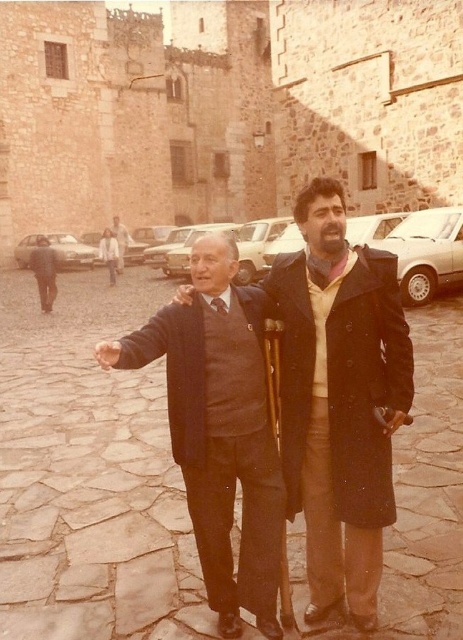
Question: Is dark blue wool coat at center to the left of matte silver sedan at left from the viewer's perspective?

Choices:
 (A) no
 (B) yes

Answer: (A)

Question: Which object is farther from the camera taking this photo?

Choices:
 (A) dark brown leather coat at center
 (B) white glossy sedan at center
 (C) dark blue wool coat at center
 (D) matte silver sedan at left

Answer: (D)

Question: Among these objects, which one is farthest from the camera?

Choices:
 (A) dark gray coat at center
 (B) white glossy sedan at center
 (C) dark blue wool coat at center
 (D) matte black coat at center

Answer: (D)

Question: Can you confirm if dark gray coat at center is positioned to the left of matte black coat at center?

Choices:
 (A) yes
 (B) no

Answer: (A)

Question: Where is dark blue wool coat at center located in relation to matte black coat at center in the image?

Choices:
 (A) left
 (B) right

Answer: (B)

Question: Which is farther from the matte silver sedan at left?

Choices:
 (A) dark brown leather coat at center
 (B) white glossy sedan at center

Answer: (A)